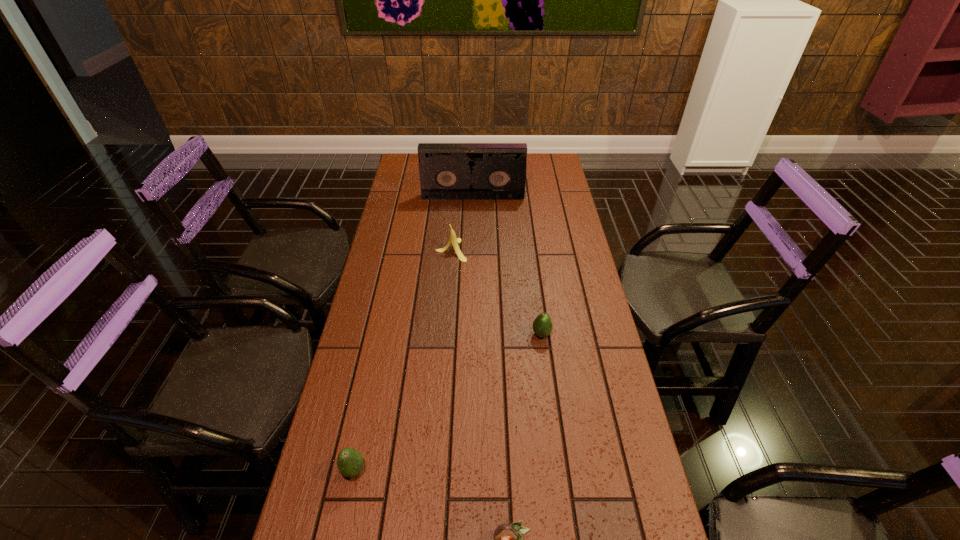
Image resolution: width=960 pixels, height=540 pixels. I want to click on vacant space situated 0.330m on the right of the second nearest object, so click(x=505, y=470).

I want to click on vacant space located on the left of the third nearest object, so click(408, 334).

The width and height of the screenshot is (960, 540). Find the location of `videotape located in the left edge section of the desktop`. videotape located in the left edge section of the desktop is located at coordinates (448, 171).

Where is `avocado positioned at the left edge`? avocado positioned at the left edge is located at coordinates (350, 462).

You are a GUI agent. You are given a task and a screenshot of the screen. Output one action in this format:
    pyautogui.click(x=<x>, y=<y>)
    Task: Click on the vacant space at the left edge of the desktop
    This screenshot has height=540, width=960.
    Given the screenshot: What is the action you would take?
    pyautogui.click(x=366, y=332)

Where is `vacant area at the right edge of the desktop`? vacant area at the right edge of the desktop is located at coordinates (561, 388).

Where is `vacant region at the far right corner of the desktop`? The width and height of the screenshot is (960, 540). vacant region at the far right corner of the desktop is located at coordinates (537, 157).

Identify the location of vacant space that's between the second farthest object and the third farthest object. This screenshot has height=540, width=960. (496, 292).

Find the location of `vacant space that is in between the fourth farthest object and the second farthest object`. vacant space that is in between the fourth farthest object and the second farthest object is located at coordinates (402, 360).

Locate an element on the screen. This screenshot has width=960, height=540. vacant space that is in between the second tallest object and the farthest object is located at coordinates (462, 224).